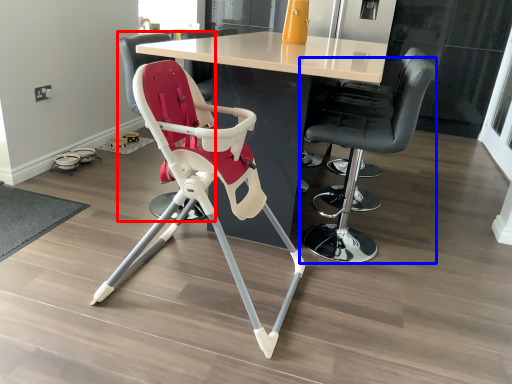
Question: Which object appears farthest to the camera in this image, chair (highlighted by a red box) or chair (highlighted by a blue box)?

Choices:
 (A) chair
 (B) chair

Answer: (A)